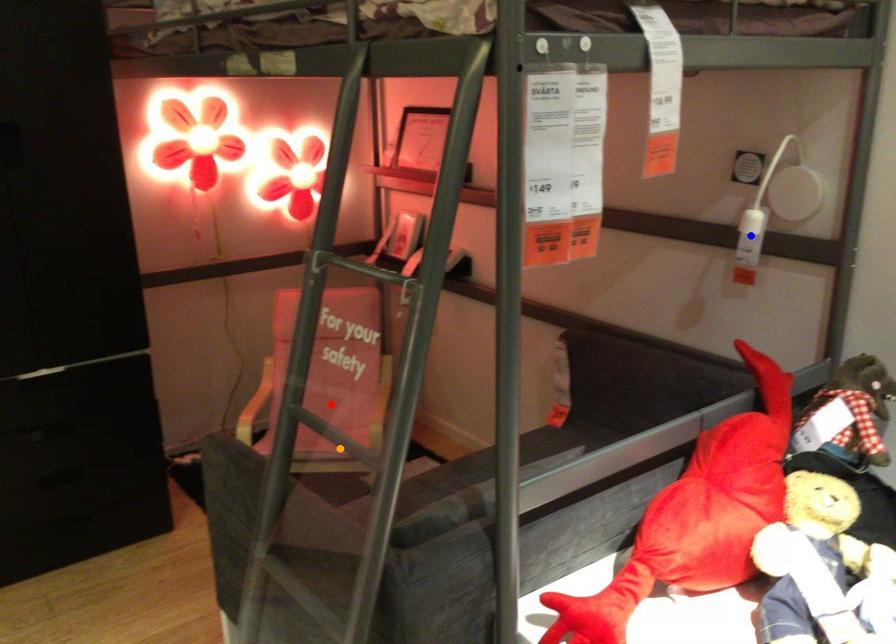
Order these from nearest to farthest:
red point
blue point
orange point

1. orange point
2. blue point
3. red point